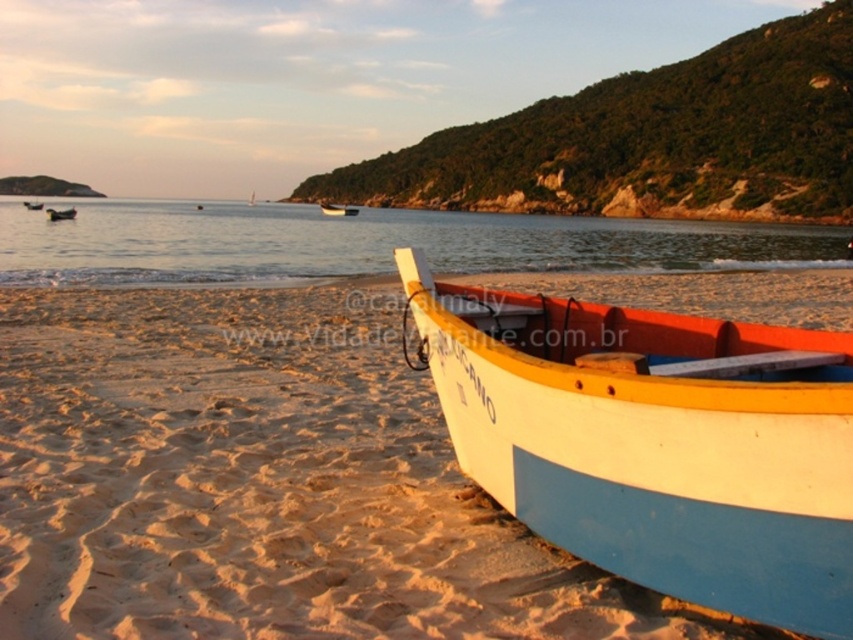
Question: Does white painted wood boat at lower right appear on the left side of white wooden boat at lower right?

Choices:
 (A) yes
 (B) no

Answer: (B)

Question: Which of the following is the farthest from the observer?

Choices:
 (A) matte black boat at left
 (B) clear water at center
 (C) wooden boat at center
 (D) white painted wood boat at lower right

Answer: (C)

Question: In this image, where is white painted wood boat at lower right located relative to white wooden boat at lower right?

Choices:
 (A) right
 (B) left

Answer: (A)

Question: Can you confirm if white painted wood boat at lower right is positioned to the left of white wooden boat at lower right?

Choices:
 (A) no
 (B) yes

Answer: (A)

Question: Which point is farther to the camera?

Choices:
 (A) (610, 268)
 (B) (712, 500)
 (C) (49, 209)
 (D) (27, 205)

Answer: (D)

Question: Which point is closer to the camera taking this photo?

Choices:
 (A) (566, 544)
 (B) (67, 216)
 (C) (28, 204)
 (D) (138, 278)

Answer: (A)